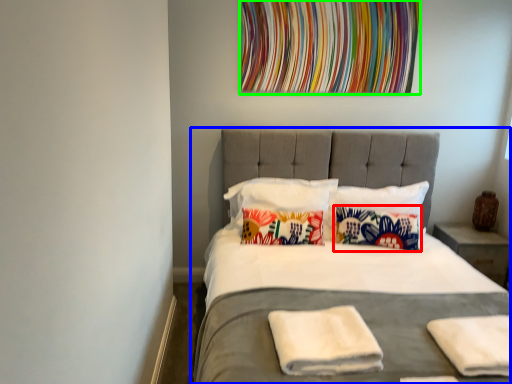
Question: Which object is positioned closest to pillow (highlighted by a red box)? Select from bed (highlighted by a blue box) and tapestry (highlighted by a green box).

Choices:
 (A) bed
 (B) tapestry

Answer: (A)